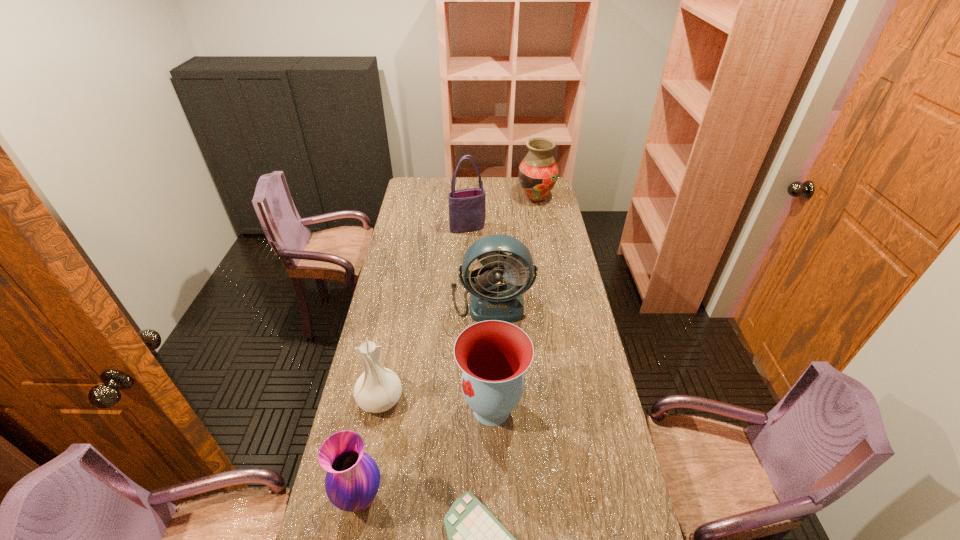
Find the location of a particular element. the sixth nearest object is located at coordinates (467, 207).

I want to click on fan, so click(502, 257).

Find the location of a particular element. the farthest object is located at coordinates (538, 172).

Find the location of `the farthest vase`. the farthest vase is located at coordinates (538, 172).

Where is `the second vase from right to left`? the second vase from right to left is located at coordinates tap(493, 355).

Locate an element on the screen. the nearest vase is located at coordinates (352, 481).

In order to click on free space located on the front of the tote bag in this screenshot , I will do `click(466, 275)`.

Locate an element on the screen. The width and height of the screenshot is (960, 540). vacant region located in front of the third farthest object to blow air is located at coordinates (492, 339).

The image size is (960, 540). I want to click on free location located on the left of the farthest object, so click(x=448, y=199).

The width and height of the screenshot is (960, 540). What are the coordinates of `free space located on the back of the third vase from left to right` in the screenshot? It's located at (490, 327).